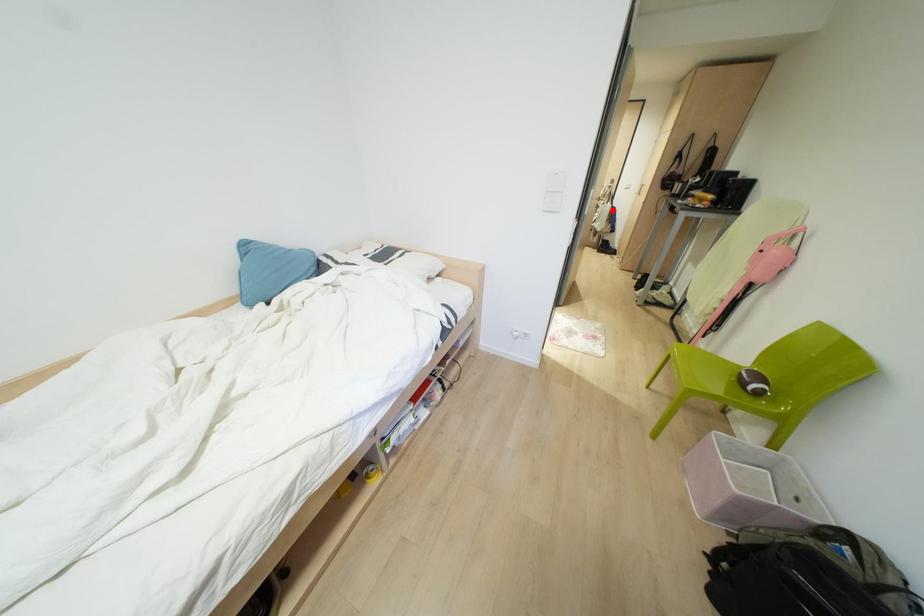
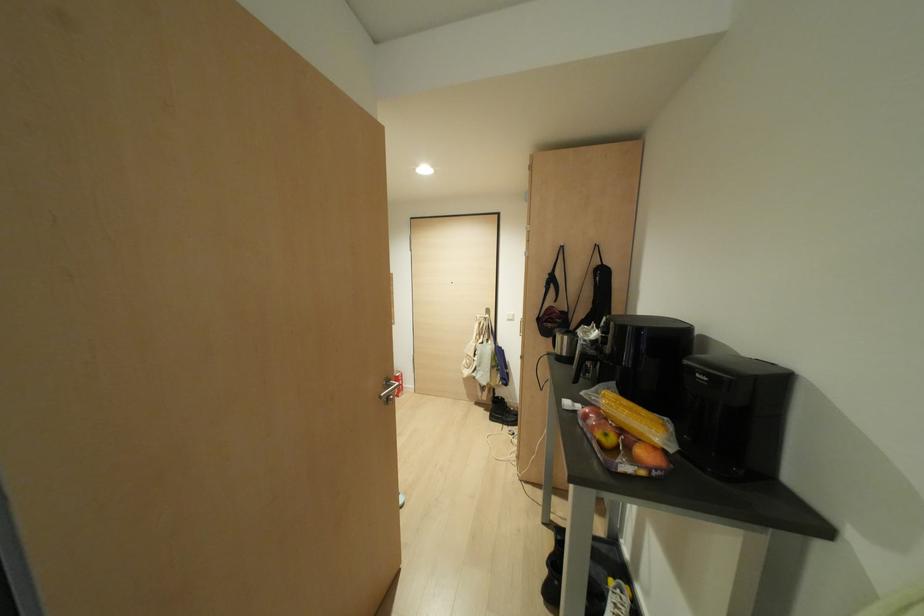
Where in the second image is the point corresponding to the highlighted location from the first image?

(497, 352)